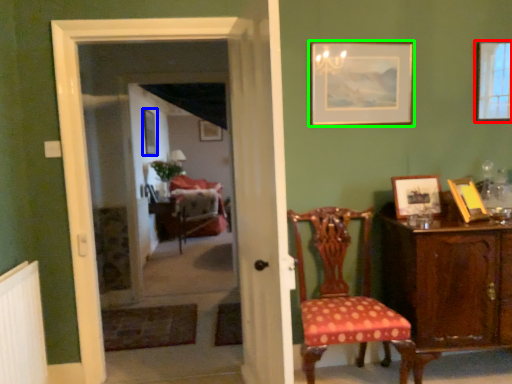
Question: Based on their relative distances, which object is farther from picture frame (highlighted by a red box)? Choose from picture frame (highlighted by a blue box) and picture frame (highlighted by a green box).

Choices:
 (A) picture frame
 (B) picture frame

Answer: (A)